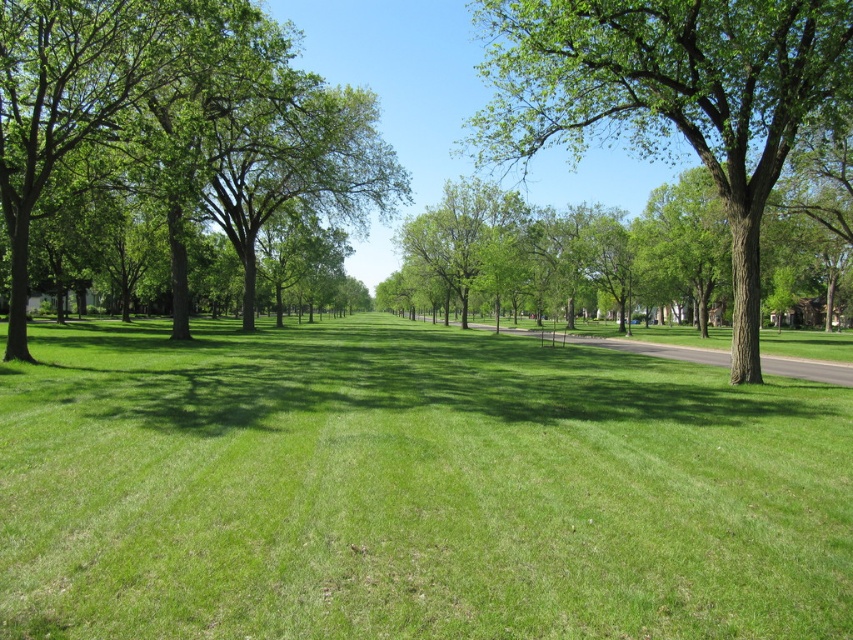
You are standing in the park and see the green grassy field at center and the green leafy tree at left. Which object is positioned to the right of the other?

The green grassy field at center is positioned to the right of the green leafy tree at left.

You are a landscape architect designing a new park. You need to place a 100 meter long walking path that starts at the green grassy field at center and ends at the green rough bark tree at center. Can you fit the path within the space between them?

The distance between the green grassy field at center and the green rough bark tree at center is 33.73 meters. Since the walking path is 100 meters long, it cannot be placed within the space between them as the distance is shorter than the path length.

You are planning to set up a picnic blanket in the park. You want to choose a spot that is under the shade of either the green rough bark tree at center or the green leafy tree at left. Which tree would provide a bigger shaded area for your picnic?

The green rough bark tree at center has a larger size compared to the green leafy tree at left, so it would provide a bigger shaded area for the picnic.